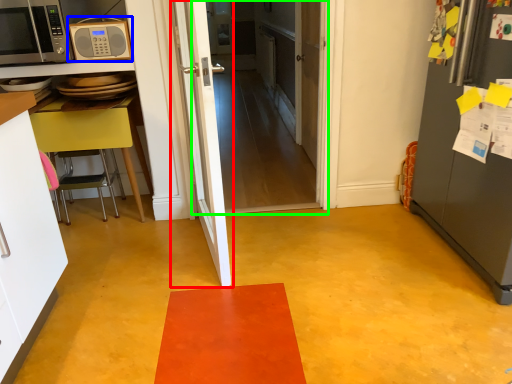
Question: Which object is positioned closest to door (highlighted by a red box)? Select from microwave oven (highlighted by a blue box) and door (highlighted by a green box).

Choices:
 (A) microwave oven
 (B) door

Answer: (A)